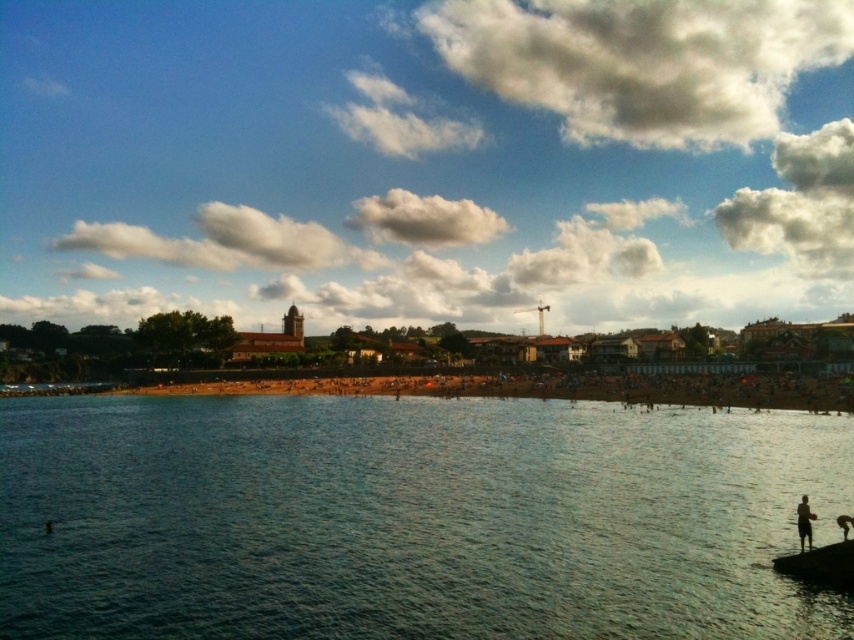
Question: Which point is closer to the camera?

Choices:
 (A) (806, 499)
 (B) (790, 460)

Answer: (A)

Question: Does clear blue water at center have a greater width compared to silhouette human at lower right?

Choices:
 (A) yes
 (B) no

Answer: (A)

Question: In this image, where is clear blue water at center located relative to silhouette human at lower right?

Choices:
 (A) above
 (B) below

Answer: (B)

Question: Can you confirm if clear blue water at center is bigger than silhouette human at lower right?

Choices:
 (A) no
 (B) yes

Answer: (B)

Question: Among these objects, which one is farthest from the camera?

Choices:
 (A) silhouette human at lower right
 (B) clear blue water at center

Answer: (A)